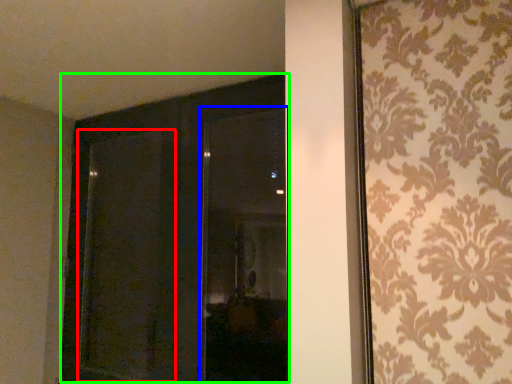
Question: Considering the real-world distances, which object is closest to screen door (highlighted by a red box)? window (highlighted by a blue box) or door (highlighted by a green box).

Choices:
 (A) window
 (B) door

Answer: (B)